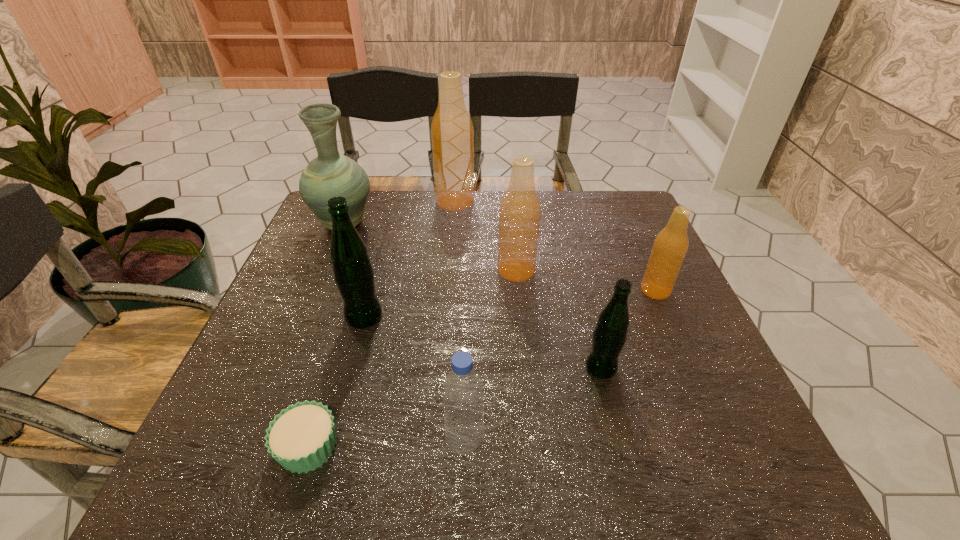
Find the location of `the rightmost beer bottle`. the rightmost beer bottle is located at coordinates (670, 246).

Locate an element on the screen. The image size is (960, 540). blue bottle is located at coordinates (463, 398).

This screenshot has width=960, height=540. I want to click on the shortest object, so click(301, 438).

The width and height of the screenshot is (960, 540). I want to click on free region located 0.190m on the right of the farthest tan beer bottle, so click(x=536, y=201).

Locate an element on the screen. The height and width of the screenshot is (540, 960). vacant position located on the handle side of the pitcher is located at coordinates (356, 193).

Identify the location of vacant space located 0.090m on the handle side of the pitcher. (357, 192).

Locate an element on the screen. The width and height of the screenshot is (960, 540). free spot located on the left of the third beer bottle from left to right is located at coordinates (394, 271).

What are the coordinates of `vacant space situated on the front of the second nearest beer bottle` in the screenshot? It's located at (321, 477).

The image size is (960, 540). I want to click on vacant space located on the front of the nearer green beer bottle, so click(614, 422).

Where is `vacant space positioned on the back of the rightmost object`? The height and width of the screenshot is (540, 960). vacant space positioned on the back of the rightmost object is located at coordinates (628, 227).